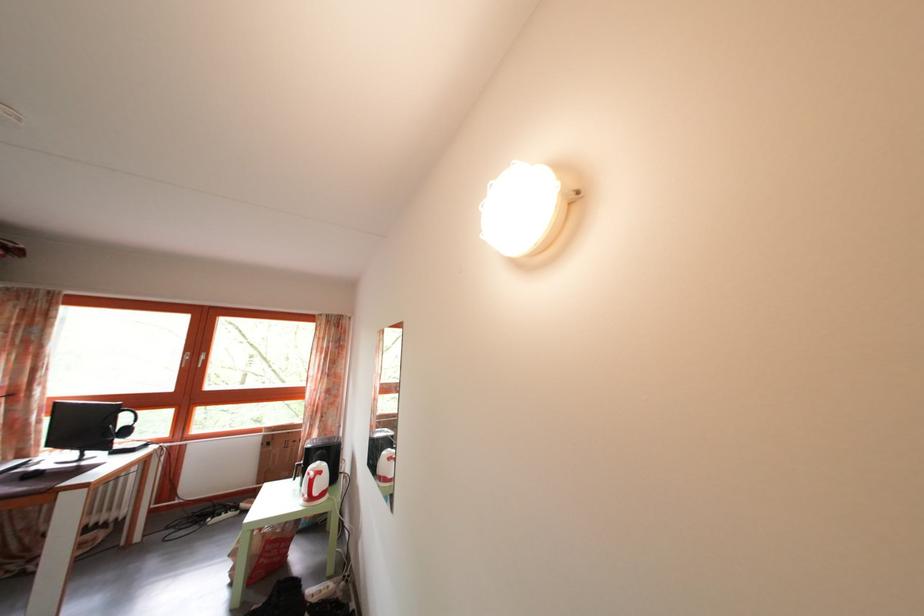
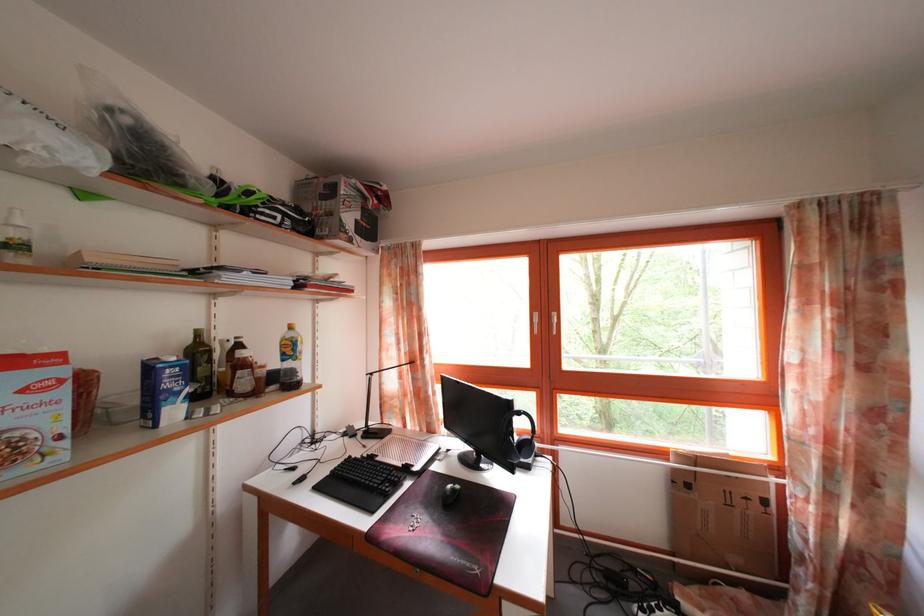
In the second image, find the point that corresponds to [128,451] in the first image.

(525, 467)